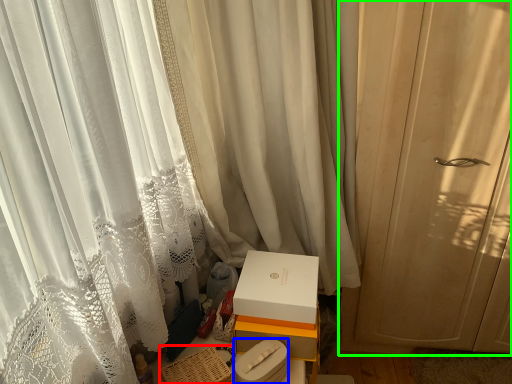
Question: Based on their relative distances, which object is nearer to basket (highlighted by a red box)? Choose from box (highlighted by a blue box) and curtain (highlighted by a green box).

Choices:
 (A) box
 (B) curtain

Answer: (A)